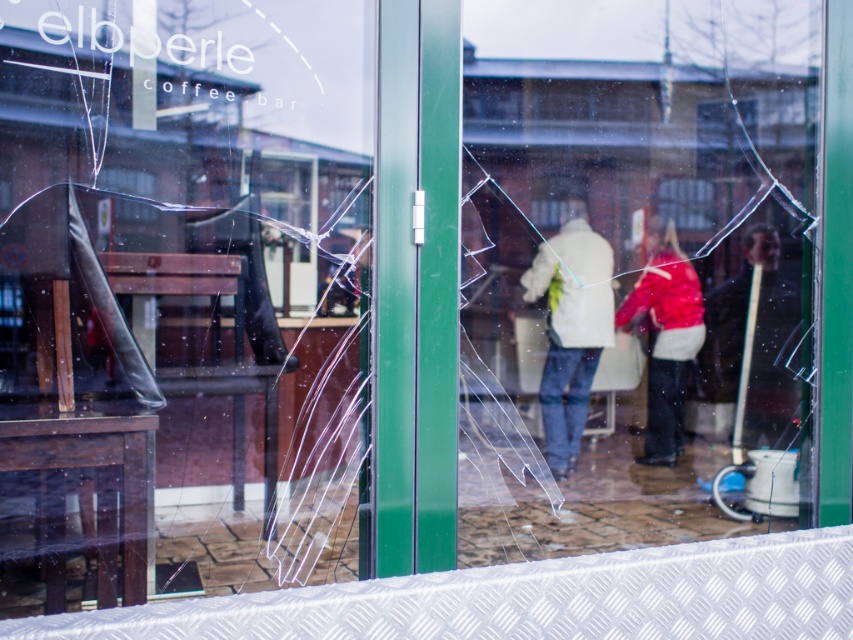
Question: Is transparent glass shop window at center thinner than red matte jacket at center?

Choices:
 (A) yes
 (B) no

Answer: (B)

Question: Which of the following is the farthest from the observer?

Choices:
 (A) red matte jacket at center
 (B) transparent glass door at center

Answer: (A)

Question: Is transparent glass shop window at center further to the viewer compared to white matte jacket at center?

Choices:
 (A) yes
 (B) no

Answer: (B)

Question: Which object is positioned closest to the transparent glass shop window at center?

Choices:
 (A) transparent glass door at center
 (B) red matte jacket at center
 (C) dark brown leather jacket at right
 (D) white matte jacket at center

Answer: (A)

Question: Is transparent glass shop window at center closer to the viewer compared to dark brown leather jacket at right?

Choices:
 (A) yes
 (B) no

Answer: (A)

Question: Among these points, which one is nearest to the camera?

Choices:
 (A) (689, 522)
 (B) (310, 42)
 (C) (672, 324)
 (D) (764, 384)

Answer: (B)